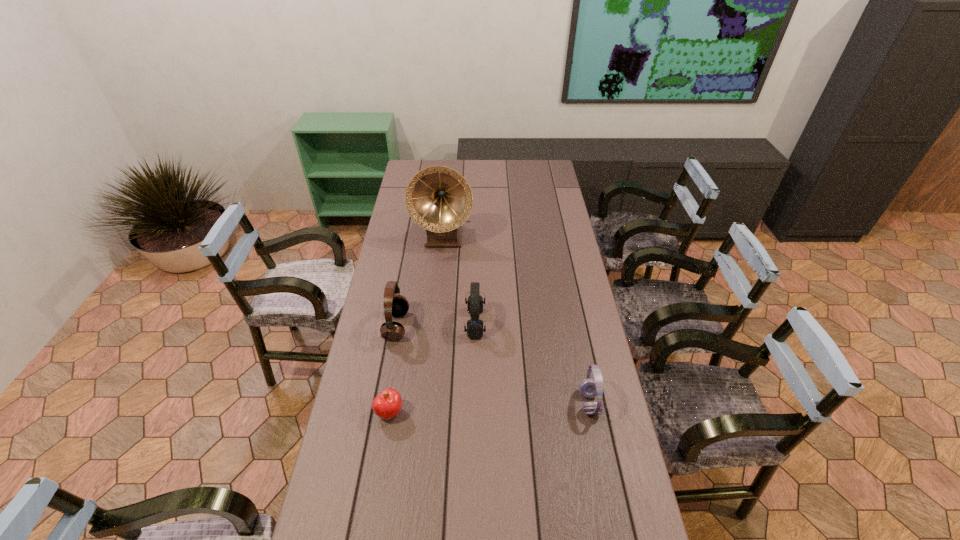
You are a GUI agent. You are given a task and a screenshot of the screen. Output one action in this format:
    pyautogui.click(x=<x>, y=<y>)
    Task: Click on the farthest object
    Image resolution: width=960 pixels, height=540 pixels.
    Given the screenshot: What is the action you would take?
    pyautogui.click(x=439, y=199)

The image size is (960, 540). What are the coordinates of `the tallest object` in the screenshot? It's located at (439, 199).

In order to click on the leftmost headset in this screenshot , I will do `click(397, 305)`.

Image resolution: width=960 pixels, height=540 pixels. Identify the location of the second headset from right to left. (475, 301).

The image size is (960, 540). In order to click on the nearest headset in this screenshot , I will do `click(589, 388)`.

You are a GUI agent. You are given a task and a screenshot of the screen. Output one action in this format:
    pyautogui.click(x=<x>, y=<y>)
    Task: Click on the rightmost object
    The width and height of the screenshot is (960, 540).
    Given the screenshot: What is the action you would take?
    pyautogui.click(x=589, y=388)

Image resolution: width=960 pixels, height=540 pixels. What are the coordinates of `the shortest object` in the screenshot? It's located at (387, 404).

Where is `free space located on the horn of the farthest object`? This screenshot has width=960, height=540. free space located on the horn of the farthest object is located at coordinates (438, 292).

I want to click on free spot located on the ear pads of the leftmost headset, so click(x=440, y=326).

The image size is (960, 540). Identify the location of vacant space located 0.120m on the headband of the second headset from left to right. (519, 323).